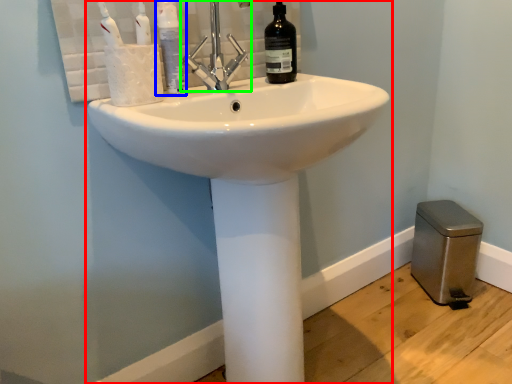
Question: Which object is positioned closest to sink (highlighted by a red box)? Select from mouthwash (highlighted by a blue box) and tap (highlighted by a green box).

Choices:
 (A) mouthwash
 (B) tap

Answer: (B)